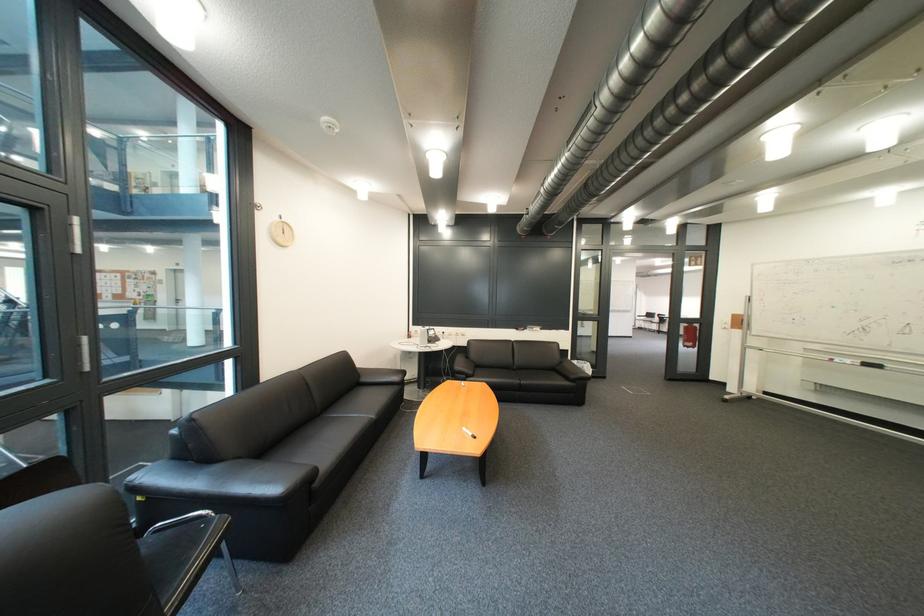
Find the location of `black chair sitting surface`. black chair sitting surface is located at coordinates (165, 560).